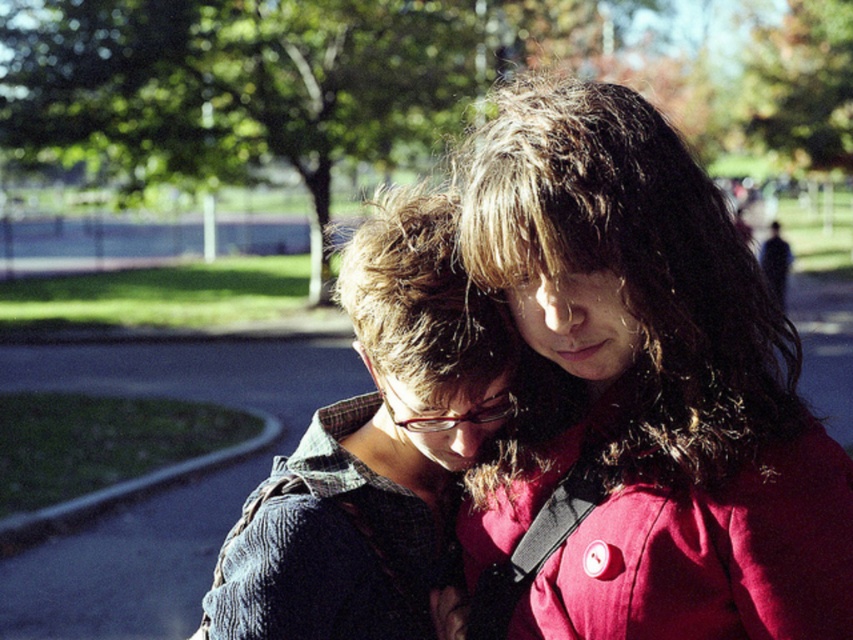
Measure the distance from matte blue sweater at center to denim jacket at center.

matte blue sweater at center and denim jacket at center are 10.81 inches apart from each other.

Who is positioned more to the right, matte blue sweater at center or denim jacket at center?

From the viewer's perspective, matte blue sweater at center appears more on the right side.

Find the location of a particular element. matte blue sweater at center is located at coordinates (639, 396).